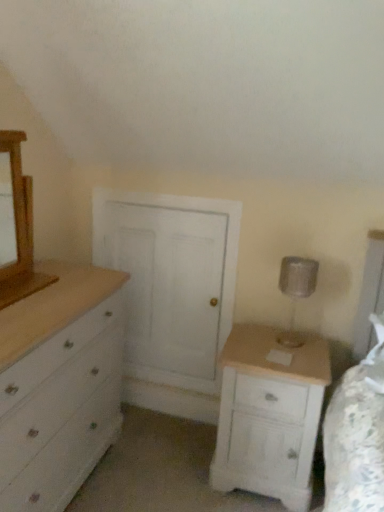
Find the location of a particular element. free region under silver metallic table lamp at right (from a real-world perspective) is located at coordinates (299, 338).